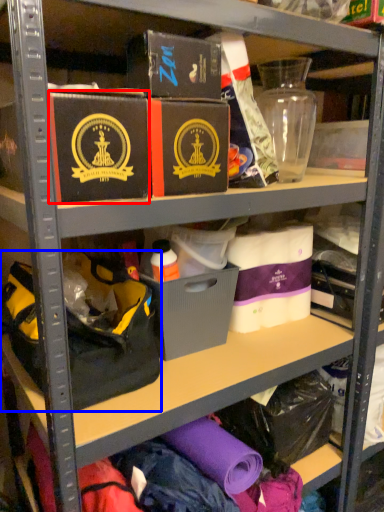
Question: Which of the following is the closest to the observer, box (highlighted by a red box) or handbag (highlighted by a blue box)?

Choices:
 (A) box
 (B) handbag

Answer: (A)